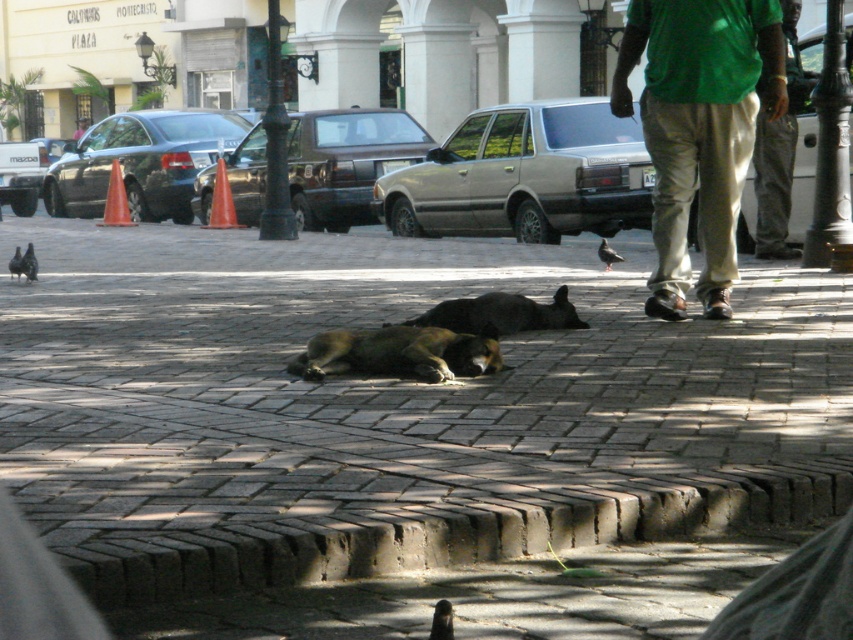
You are a photographer trying to capture a clear shot of the silver metallic sedan at center and the gray matte pigeon at lower left. Based on their positions, which object is closer to the camera?

The gray matte pigeon at lower left is closer to the camera because it is positioned below the silver metallic sedan at center, which is located above it.

You are standing at the point of origin in the plaza and want to find the silver metallic sedan at center. According to the coordinates provided, where should you look relative to your position?

The silver metallic sedan at center is located at coordinates point (x=525, y=176), which means it is positioned to the right and slightly forward from your current position.